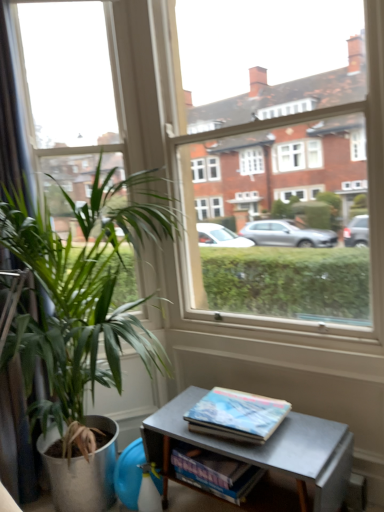
Question: Is green leafy plant at left shorter than clear glass window at center?

Choices:
 (A) no
 (B) yes

Answer: (B)

Question: Is green leafy plant at left positioned before clear glass window at center?

Choices:
 (A) yes
 (B) no

Answer: (A)

Question: Can you confirm if green leafy plant at left is wider than clear glass window at center?

Choices:
 (A) no
 (B) yes

Answer: (B)

Question: Does green leafy plant at left have a larger size compared to clear glass window at center?

Choices:
 (A) no
 (B) yes

Answer: (B)

Question: From the image's perspective, is green leafy plant at left on clear glass window at center?

Choices:
 (A) no
 (B) yes

Answer: (A)

Question: Based on their positions, is green leafy plant at left located to the left or right of metallic gray table at lower right?

Choices:
 (A) left
 (B) right

Answer: (A)

Question: In terms of height, does green leafy plant at left look taller or shorter compared to metallic gray table at lower right?

Choices:
 (A) short
 (B) tall

Answer: (B)

Question: Is point (115, 350) closer or farther from the camera than point (157, 459)?

Choices:
 (A) closer
 (B) farther

Answer: (B)

Question: In terms of size, does green leafy plant at left appear bigger or smaller than metallic gray table at lower right?

Choices:
 (A) big
 (B) small

Answer: (A)

Question: Is clear glass window at center inside the boundaries of hardcover book at lower right, or outside?

Choices:
 (A) outside
 (B) inside

Answer: (A)

Question: Is point (269, 265) closer or farther from the camera than point (249, 413)?

Choices:
 (A) farther
 (B) closer

Answer: (A)

Question: Is clear glass window at center in front of or behind hardcover book at lower right in the image?

Choices:
 (A) front
 (B) behind

Answer: (A)

Question: Looking at their shapes, would you say clear glass window at center is wider or thinner than hardcover book at lower right?

Choices:
 (A) wide
 (B) thin

Answer: (B)

Question: From a real-world perspective, is black fabric curtain at left physically located above or below clear glass window at center?

Choices:
 (A) below
 (B) above

Answer: (A)

Question: Is point (9, 116) closer or farther from the camera than point (109, 18)?

Choices:
 (A) farther
 (B) closer

Answer: (B)